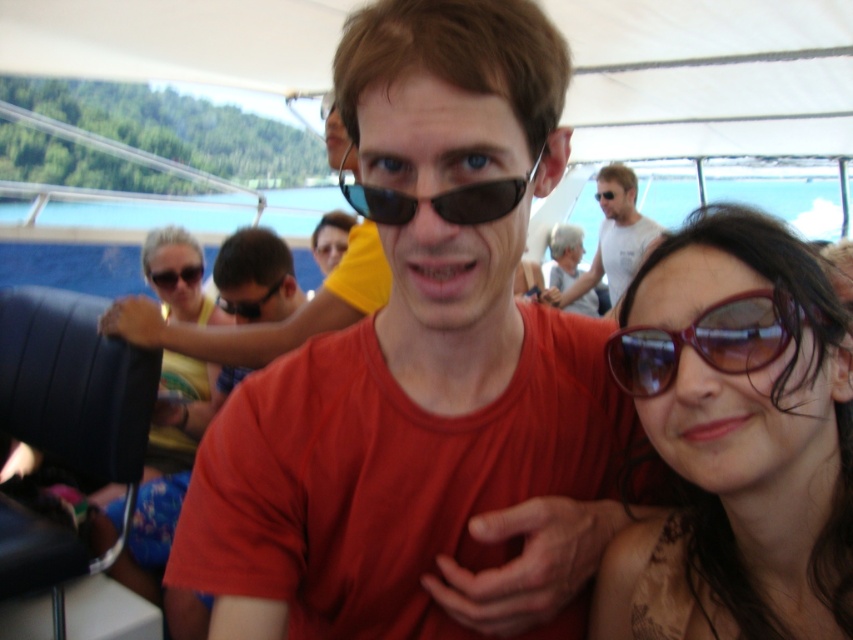
You are a photographer standing at the front of the boat and want to take a closeup photo of the matte black sunglasses at center. The minimum focusing distance of your camera is 8 feet. Will you be able to take the photo without moving closer?

The matte black sunglasses at center are 7.74 feet away from the camera. Since the minimum focusing distance is 8 feet, the photographer needs to move back to be at least 8 feet away to focus properly. Therefore, they cannot take the photo without moving closer because the current distance is too close.

You are a photographer trying to capture a closeup of both the matte black sunglasses at upper left and the black plastic goggles at center in the scene. Given their distance apart, can you fit both into your camera frame that has a maximum width of 40 centimeters?

The matte black sunglasses at upper left and black plastic goggles at center are 43.87 centimeters apart from each other. Since the distance between them exceeds the camera frame width of 40 centimeters, you cannot fit both into the frame.